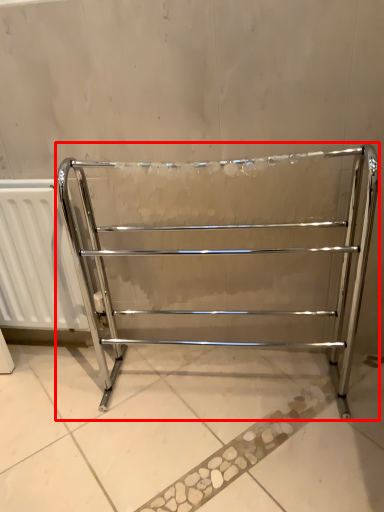
Question: From the image's perspective, where is furniture (annotated by the red box) located relative to radiator?

Choices:
 (A) above
 (B) below

Answer: (B)